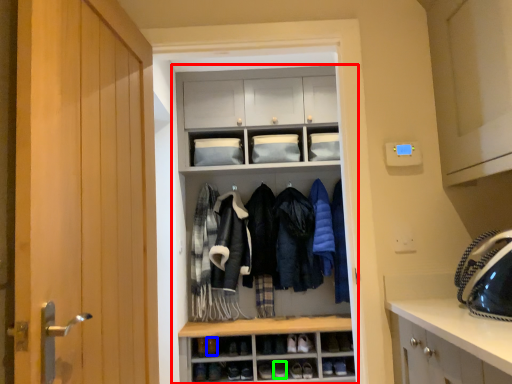
Question: Which is farther away from cupboard (highlighted by a red box)? shoe (highlighted by a blue box) or shoe (highlighted by a green box)?

Choices:
 (A) shoe
 (B) shoe

Answer: (B)